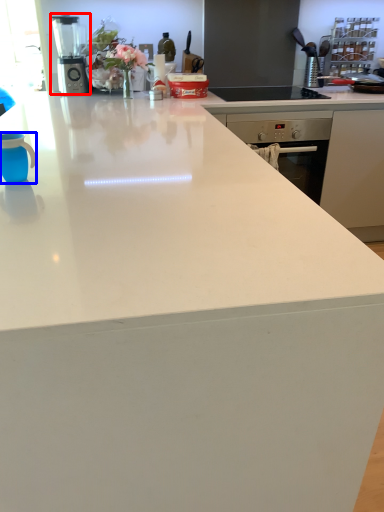
Question: Among these objects, which one is nearest to the camera, kitchen appliance (highlighted by a red box) or mug (highlighted by a blue box)?

Choices:
 (A) kitchen appliance
 (B) mug

Answer: (B)